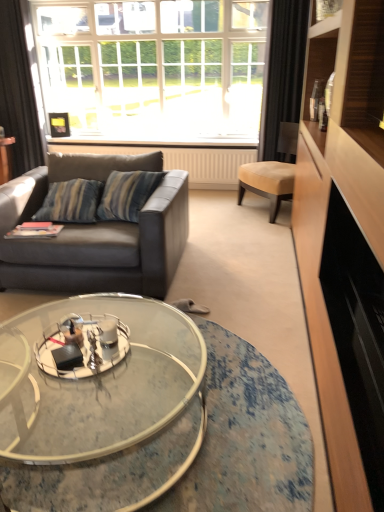
Question: Is white textured radiator at center facing away from suede-like tan chair at right?

Choices:
 (A) no
 (B) yes

Answer: (A)

Question: Considering the relative positions of white textured radiator at center and suede-like tan chair at right in the image provided, is white textured radiator at center in front of suede-like tan chair at right?

Choices:
 (A) no
 (B) yes

Answer: (A)

Question: From the image's perspective, is white textured radiator at center above suede-like tan chair at right?

Choices:
 (A) no
 (B) yes

Answer: (B)

Question: Is suede-like tan chair at right completely or partially inside white textured radiator at center?

Choices:
 (A) yes
 (B) no

Answer: (B)

Question: From a real-world perspective, is white textured radiator at center on top of suede-like tan chair at right?

Choices:
 (A) yes
 (B) no

Answer: (B)

Question: From a real-world perspective, is white textured radiator at center physically located above or below clear glass window at upper center?

Choices:
 (A) above
 (B) below

Answer: (B)

Question: Is point (49, 150) positioned closer to the camera than point (211, 30)?

Choices:
 (A) farther
 (B) closer

Answer: (B)

Question: Considering their positions, is white textured radiator at center located in front of or behind clear glass window at upper center?

Choices:
 (A) front
 (B) behind

Answer: (B)

Question: Considering the positions of white textured radiator at center and clear glass window at upper center in the image, is white textured radiator at center wider or thinner than clear glass window at upper center?

Choices:
 (A) thin
 (B) wide

Answer: (A)

Question: Is black fabric curtain at upper right, which is the 2th curtain from left to right, to the left or to the right of suede-like tan chair at right in the image?

Choices:
 (A) left
 (B) right

Answer: (B)

Question: Which is correct: black fabric curtain at upper right, which is the 2th curtain from left to right, is inside suede-like tan chair at right, or outside of it?

Choices:
 (A) outside
 (B) inside

Answer: (A)

Question: Is point (273, 111) closer or farther from the camera than point (258, 194)?

Choices:
 (A) closer
 (B) farther

Answer: (A)

Question: From the image's perspective, is black fabric curtain at upper right, which is the 2th curtain from left to right, above or below suede-like tan chair at right?

Choices:
 (A) above
 (B) below

Answer: (A)

Question: Considering the positions of suede-like tan chair at right and white textured radiator at center in the image, is suede-like tan chair at right taller or shorter than white textured radiator at center?

Choices:
 (A) short
 (B) tall

Answer: (B)

Question: Does point (288, 163) appear closer or farther from the camera than point (87, 146)?

Choices:
 (A) farther
 (B) closer

Answer: (B)